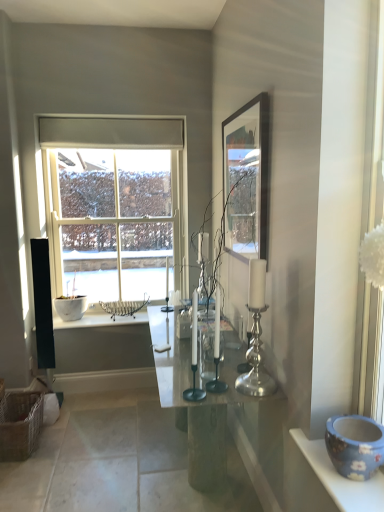
Question: Does clear glass window at center have a greater height compared to silver metallic candle holder at center, the second candle holder in the right-to-left sequence?

Choices:
 (A) no
 (B) yes

Answer: (B)

Question: Is clear glass window at center smaller than silver metallic candle holder at center, the second candle holder in the right-to-left sequence?

Choices:
 (A) yes
 (B) no

Answer: (B)

Question: Is clear glass window at center aimed at silver metallic candle holder at center, the second candle holder in the right-to-left sequence?

Choices:
 (A) no
 (B) yes

Answer: (B)

Question: Is clear glass window at center closer to the viewer compared to silver metallic candle holder at center, the second candle holder in the right-to-left sequence?

Choices:
 (A) yes
 (B) no

Answer: (B)

Question: Could silver metallic candle holder at center, the second candle holder in the right-to-left sequence, be considered to be inside clear glass window at center?

Choices:
 (A) yes
 (B) no

Answer: (B)

Question: In terms of width, does silver metallic candle holder at center-right, the first candle holder in the right-to-left sequence, look wider or thinner when compared to blue ceramic bowl at lower right?

Choices:
 (A) thin
 (B) wide

Answer: (A)

Question: From the image's perspective, is silver metallic candle holder at center-right, the first candle holder in the right-to-left sequence, above or below blue ceramic bowl at lower right?

Choices:
 (A) below
 (B) above

Answer: (B)

Question: Is silver metallic candle holder at center-right, the first candle holder in the right-to-left sequence, in front of or behind blue ceramic bowl at lower right in the image?

Choices:
 (A) front
 (B) behind

Answer: (B)

Question: Does point (258, 388) appear closer or farther from the camera than point (342, 470)?

Choices:
 (A) farther
 (B) closer

Answer: (A)

Question: Considering the relative positions of silver metallic candle holder at center, the second candle holder when ordered from left to right, and silver metallic candle holder at center-right, acting as the third candle holder starting from the left, in the image provided, is silver metallic candle holder at center, the second candle holder when ordered from left to right, to the left or to the right of silver metallic candle holder at center-right, acting as the third candle holder starting from the left,?

Choices:
 (A) left
 (B) right

Answer: (A)

Question: In the image, is silver metallic candle holder at center, the second candle holder when ordered from left to right, positioned in front of or behind silver metallic candle holder at center-right, the first candle holder in the right-to-left sequence?

Choices:
 (A) front
 (B) behind

Answer: (B)

Question: From the image's perspective, is silver metallic candle holder at center, the second candle holder in the right-to-left sequence, above or below silver metallic candle holder at center-right, the first candle holder in the right-to-left sequence?

Choices:
 (A) below
 (B) above

Answer: (A)

Question: From a real-world perspective, is silver metallic candle holder at center, the second candle holder in the right-to-left sequence, physically located above or below silver metallic candle holder at center-right, acting as the third candle holder starting from the left?

Choices:
 (A) below
 (B) above

Answer: (A)

Question: From a real-world perspective, relative to clear glass window at center, is silver metallic candle holder at center, the third candle holder viewed from the right, vertically above or below?

Choices:
 (A) above
 (B) below

Answer: (B)

Question: Considering the positions of point (196, 393) and point (125, 196), is point (196, 393) closer or farther from the camera than point (125, 196)?

Choices:
 (A) closer
 (B) farther

Answer: (A)